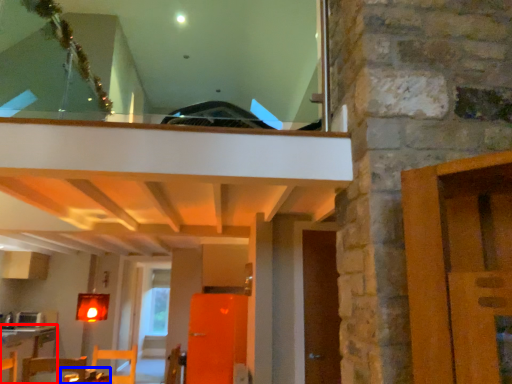
Question: Which object appears closest to the camera in this image, table (highlighted by a red box) or table (highlighted by a blue box)?

Choices:
 (A) table
 (B) table

Answer: (B)